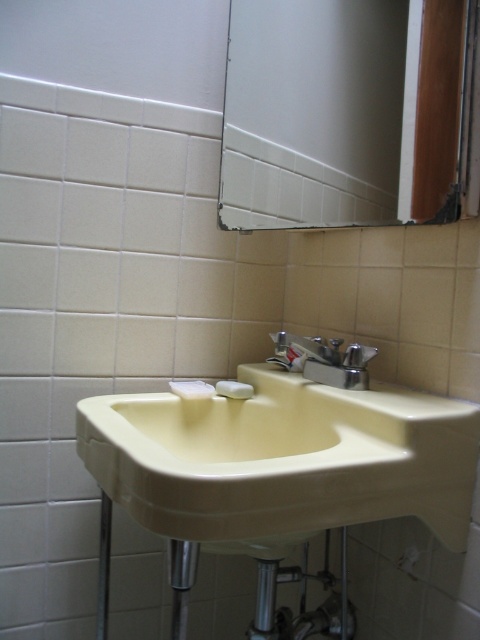
Question: Does matte glass mirror at upper center have a larger size compared to satin nickel faucet at center?

Choices:
 (A) yes
 (B) no

Answer: (A)

Question: Can you confirm if satin nickel faucet at center is positioned to the right of white matte soap at sink?

Choices:
 (A) no
 (B) yes

Answer: (B)

Question: Which point is closer to the camera taking this photo?

Choices:
 (A) (287, 192)
 (B) (324, 440)
 (C) (298, 348)

Answer: (B)

Question: Is satin nickel faucet at center closer to the viewer compared to white matte soap at sink?

Choices:
 (A) no
 (B) yes

Answer: (B)

Question: Which object appears farthest from the camera in this image?

Choices:
 (A) white matte soap at sink
 (B) matte glass mirror at upper center

Answer: (A)

Question: Which of the following is the farthest from the observer?

Choices:
 (A) matte glass mirror at upper center
 (B) satin nickel faucet at center
 (C) white matte soap at sink
 (D) beige porcelain sink at center

Answer: (C)